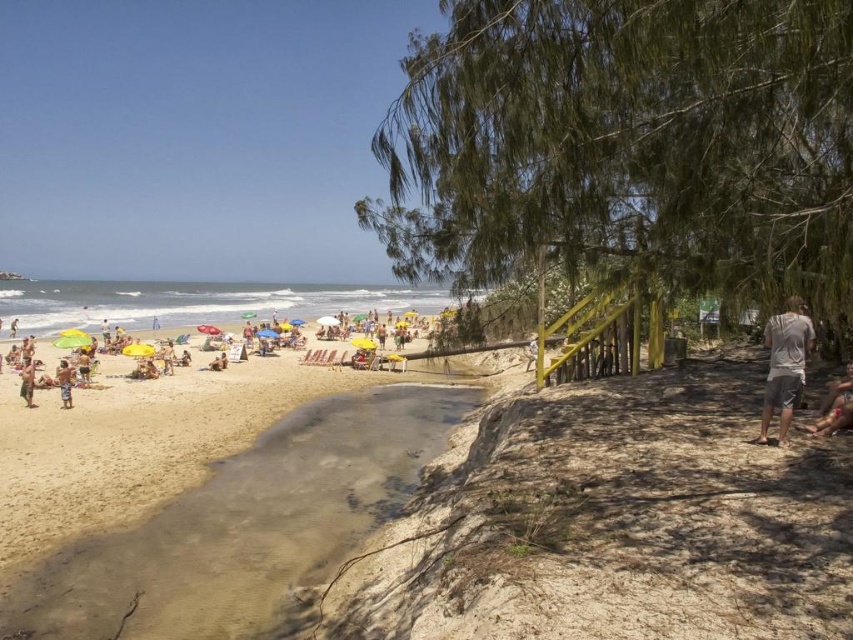
Question: Which object is the closest to the yellow umbrellas at beach left?

Choices:
 (A) light brown sand at lower left
 (B) gray cotton shirt at right

Answer: (A)

Question: Based on their relative distances, which object is nearer to the beige textured shorts at lower left?

Choices:
 (A) brown fabric shorts at lower left
 (B) gray cotton shirt at right

Answer: (A)

Question: Observing the image, what is the correct spatial positioning of yellow umbrellas at beach left in reference to gray cotton shirt at right?

Choices:
 (A) right
 (B) left

Answer: (B)

Question: Is light brown sand at lower left below gray cotton shirt at right?

Choices:
 (A) yes
 (B) no

Answer: (A)

Question: Is light brown sand at lower left behind beige textured shorts at lower left?

Choices:
 (A) no
 (B) yes

Answer: (A)

Question: Based on their relative distances, which object is nearer to the beige textured shorts at lower left?

Choices:
 (A) gray cotton shirt at right
 (B) yellow umbrellas at beach left

Answer: (A)